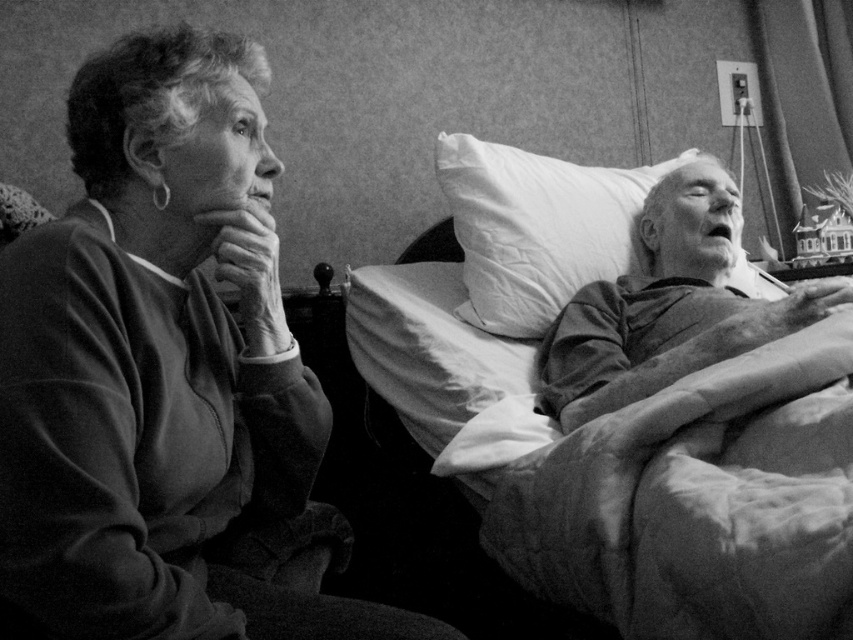
Question: Can you confirm if fluffy white pillow at right is thinner than white soft pillow at right?

Choices:
 (A) no
 (B) yes

Answer: (A)

Question: Which point is closer to the camera?

Choices:
 (A) (178, 90)
 (B) (573, 186)
 (C) (442, 317)

Answer: (A)

Question: Which object is the farthest from the fluffy white pillow at right?

Choices:
 (A) sweatshirt at left
 (B) white soft pillow at right
 (C) smooth skin man at right

Answer: (A)

Question: Which of the following is the farthest from the observer?

Choices:
 (A) pyautogui.click(x=495, y=392)
 (B) pyautogui.click(x=173, y=513)
 (C) pyautogui.click(x=705, y=364)

Answer: (A)

Question: Is sweatshirt at left smaller than fluffy white pillow at right?

Choices:
 (A) no
 (B) yes

Answer: (B)

Question: Can you confirm if sweatshirt at left is smaller than white soft pillow at right?

Choices:
 (A) no
 (B) yes

Answer: (B)